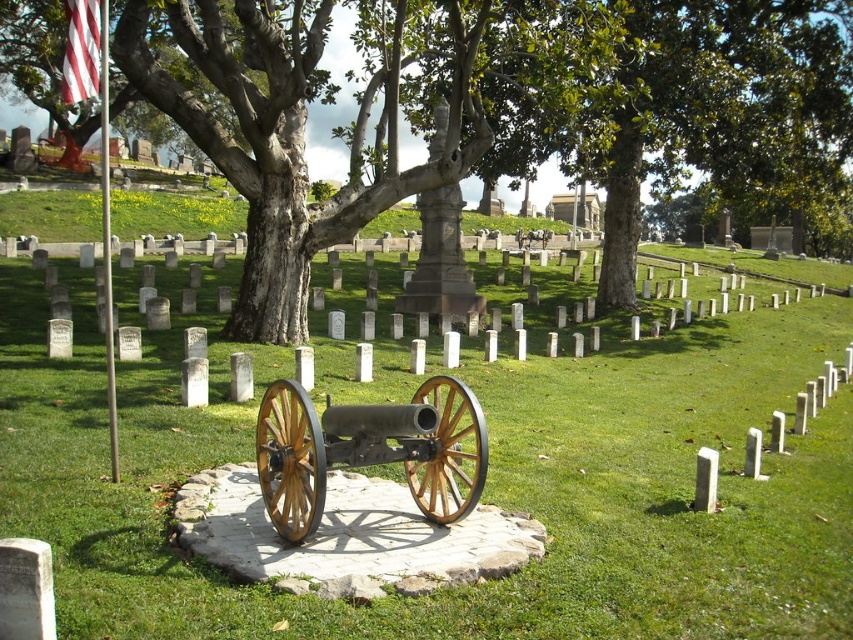
Who is positioned more to the right, green rough bark tree at center or striped fabric flag at upper left?

From the viewer's perspective, green rough bark tree at center appears more on the right side.

Where is `green rough bark tree at center`? The height and width of the screenshot is (640, 853). green rough bark tree at center is located at coordinates (491, 109).

Is point (128, 429) behind point (71, 84)?

Yes.

Is the position of green grassy at center more distant than that of striped fabric flag at upper left?

No, it is in front of striped fabric flag at upper left.

Locate an element on the screen. green grassy at center is located at coordinates (486, 476).

Does green grassy at center have a greater width compared to green rough bark tree at center?

Incorrect, green grassy at center's width does not surpass green rough bark tree at center's.

Can you confirm if green grassy at center is thinner than green rough bark tree at center?

Yes, green grassy at center is thinner than green rough bark tree at center.

Image resolution: width=853 pixels, height=640 pixels. What do you see at coordinates (486, 476) in the screenshot?
I see `green grassy at center` at bounding box center [486, 476].

Find the location of a particular element. Image resolution: width=853 pixels, height=640 pixels. green grassy at center is located at coordinates (486, 476).